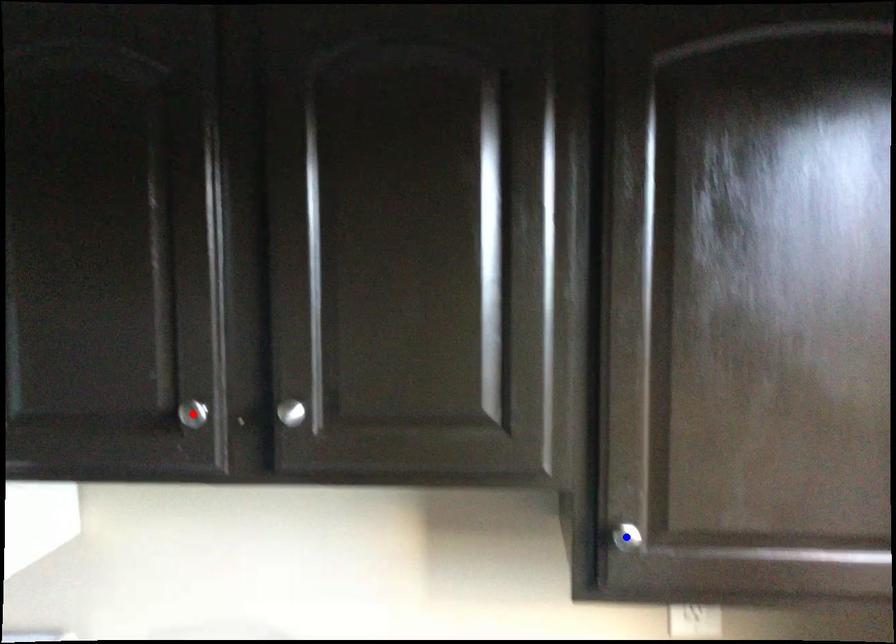
Question: Two points are marked on the image. Which point is closer to the camera?

Choices:
 (A) Blue point is closer.
 (B) Red point is closer.

Answer: (A)